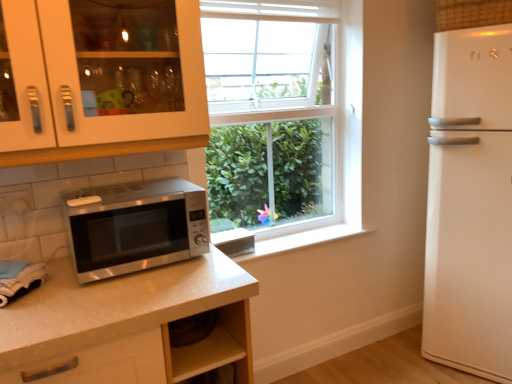
Question: Is point (115, 183) closer or farther from the camera than point (506, 142)?

Choices:
 (A) farther
 (B) closer

Answer: (B)

Question: From a real-world perspective, is satin silver microwave at lower left positioned above or below white glossy refrigerator at right?

Choices:
 (A) above
 (B) below

Answer: (A)

Question: Which object is positioned closest to the white glossy refrigerator at right?

Choices:
 (A) white glossy cabinet at upper left
 (B) satin silver microwave at lower left

Answer: (A)

Question: Estimate the real-world distances between objects in this image. Which object is closer to the white glossy refrigerator at right?

Choices:
 (A) white glossy cabinet at upper left
 (B) satin silver microwave at lower left

Answer: (A)